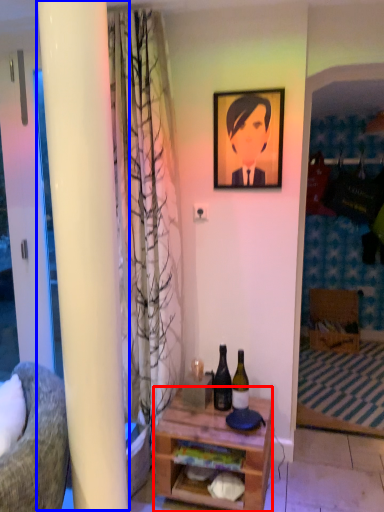
Question: Which of the following is the farthest to the observer, desk (highlighted by a red box) or pillar (highlighted by a blue box)?

Choices:
 (A) desk
 (B) pillar

Answer: (B)